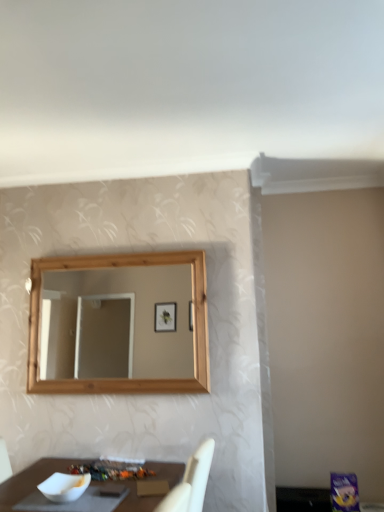
Question: Considering the positions of point (140, 472) and point (59, 484), is point (140, 472) closer or farther from the camera than point (59, 484)?

Choices:
 (A) farther
 (B) closer

Answer: (A)

Question: Is white glossy bowl at lower left to the left or to the right of white matte bowl at lower left in the image?

Choices:
 (A) right
 (B) left

Answer: (A)

Question: In terms of height, does white glossy bowl at lower left look taller or shorter compared to white matte bowl at lower left?

Choices:
 (A) tall
 (B) short

Answer: (B)

Question: Is white matte bowl at lower left bigger or smaller than white glossy bowl at lower left?

Choices:
 (A) small
 (B) big

Answer: (B)

Question: Which is correct: white matte bowl at lower left is inside white glossy bowl at lower left, or outside of it?

Choices:
 (A) inside
 (B) outside

Answer: (B)

Question: From a real-world perspective, is white matte bowl at lower left physically located above or below white glossy bowl at lower left?

Choices:
 (A) above
 (B) below

Answer: (A)

Question: Considering the positions of white matte bowl at lower left and white glossy bowl at lower left in the image, is white matte bowl at lower left wider or thinner than white glossy bowl at lower left?

Choices:
 (A) wide
 (B) thin

Answer: (B)